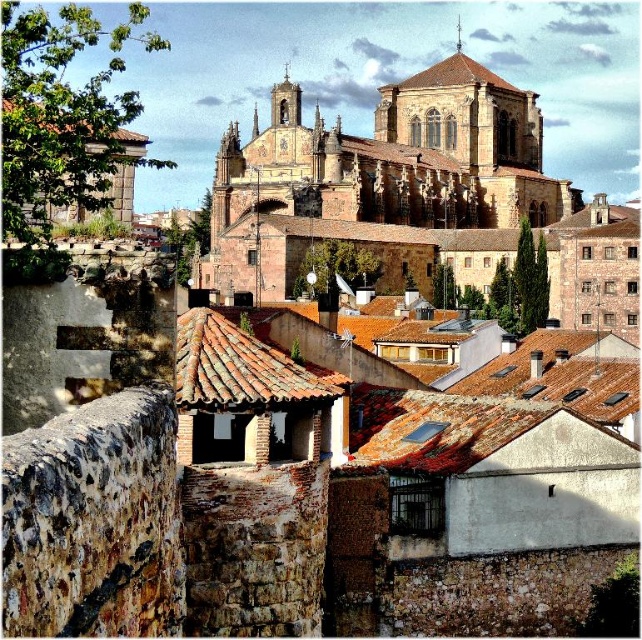
You are an architect analyzing the historic town layout. You notice the brown stone church at center and the brown tiled roof at upper center. Which structure is taller?

The brown stone church at center is taller than the brown tiled roof at upper center.

Consider the image. You are a tourist standing in front of the brown stone church at center and the terracotta tiled roof at center in the historic town. Which object is positioned to the right of the other?

The brown stone church at center is to the right of the terracotta tiled roof at center.